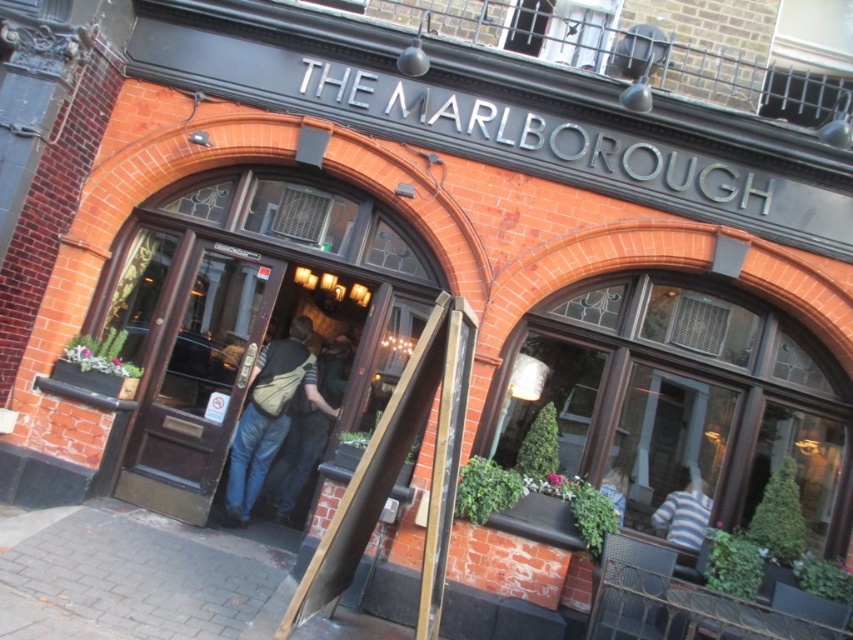
Question: Is beige canvas backpack at center smaller than striped shirt at lower right?

Choices:
 (A) no
 (B) yes

Answer: (A)

Question: Which of the following is the closest to the observer?

Choices:
 (A) (699, 534)
 (B) (326, 401)
 (C) (241, 428)
 (D) (189, 292)

Answer: (A)

Question: Is beige canvas backpack at center to the left of tan fabric backpack at center from the viewer's perspective?

Choices:
 (A) no
 (B) yes

Answer: (B)

Question: Which object is the farthest from the striped shirt at lower right?

Choices:
 (A) beige canvas backpack at center
 (B) brown wooden door at center
 (C) tan fabric backpack at center

Answer: (B)

Question: Is the position of brown wooden door at center less distant than that of striped shirt at lower right?

Choices:
 (A) yes
 (B) no

Answer: (B)

Question: Which point is farther to the camera?

Choices:
 (A) (259, 388)
 (B) (279, 476)
 (C) (187, 452)
 (D) (670, 499)

Answer: (B)